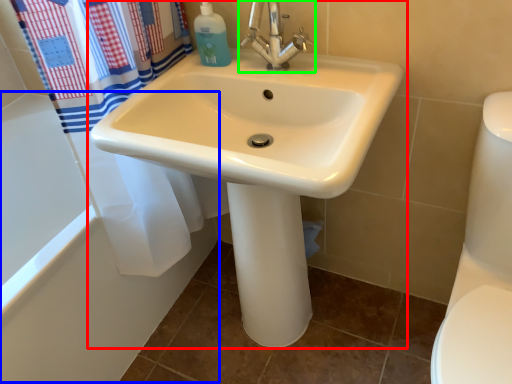
Question: Which is farther away from sink (highlighted by a red box)? bath (highlighted by a blue box) or tap (highlighted by a green box)?

Choices:
 (A) bath
 (B) tap

Answer: (A)